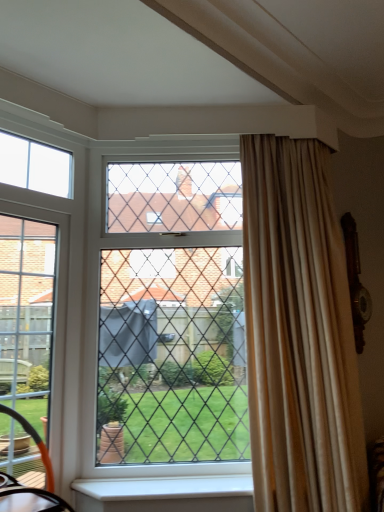
Question: Considering the relative sizes of clear glass screen door at left and white smooth window sill at lower center in the image provided, is clear glass screen door at left taller than white smooth window sill at lower center?

Choices:
 (A) yes
 (B) no

Answer: (A)

Question: Is clear glass screen door at left smaller than white smooth window sill at lower center?

Choices:
 (A) no
 (B) yes

Answer: (A)

Question: From a real-world perspective, is clear glass screen door at left below white smooth window sill at lower center?

Choices:
 (A) no
 (B) yes

Answer: (A)

Question: Can you confirm if clear glass screen door at left is thinner than white smooth window sill at lower center?

Choices:
 (A) yes
 (B) no

Answer: (A)

Question: From a real-world perspective, is clear glass screen door at left physically above white smooth window sill at lower center?

Choices:
 (A) no
 (B) yes

Answer: (B)

Question: Does clear glass screen door at left turn towards white smooth window sill at lower center?

Choices:
 (A) no
 (B) yes

Answer: (A)

Question: Would you say clear glass window at center is a long distance from clear glass screen door at left?

Choices:
 (A) no
 (B) yes

Answer: (A)

Question: Considering the relative sizes of clear glass window at center and clear glass screen door at left in the image provided, is clear glass window at center shorter than clear glass screen door at left?

Choices:
 (A) yes
 (B) no

Answer: (B)

Question: Is clear glass window at center located outside clear glass screen door at left?

Choices:
 (A) yes
 (B) no

Answer: (A)

Question: Is clear glass window at center bigger than clear glass screen door at left?

Choices:
 (A) yes
 (B) no

Answer: (A)

Question: From a real-world perspective, is clear glass window at center over clear glass screen door at left?

Choices:
 (A) no
 (B) yes

Answer: (B)

Question: Does clear glass window at center have a greater width compared to clear glass screen door at left?

Choices:
 (A) yes
 (B) no

Answer: (A)

Question: Is beige silk curtain at right smaller than white smooth window sill at lower center?

Choices:
 (A) yes
 (B) no

Answer: (B)